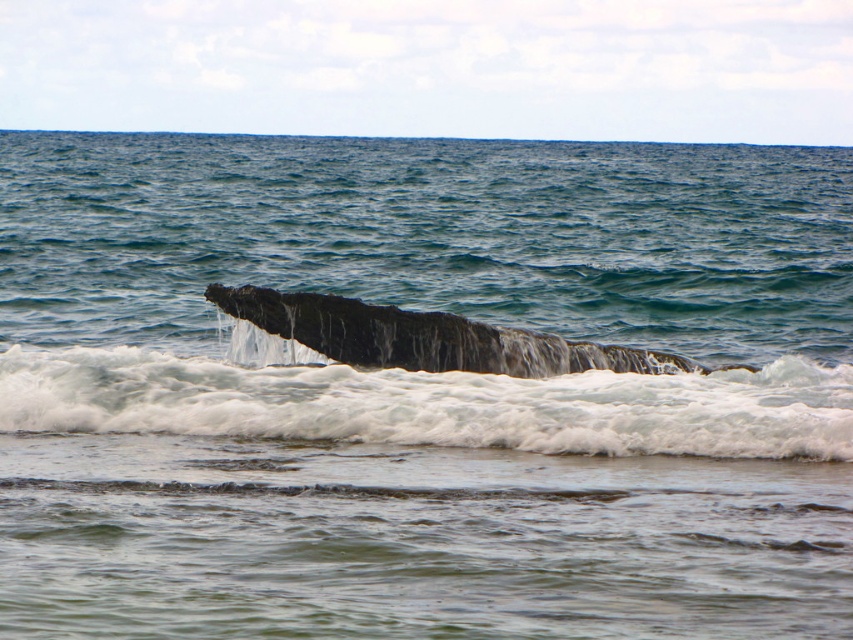
In the scene shown: Does dark gray textured rock at center come behind dark gray textured whale at center?

No, dark gray textured rock at center is closer to the viewer.

Who is more forward, (198, 422) or (701, 371)?

Positioned in front is point (198, 422).

In order to click on dark gray textured rock at center in this screenshot , I will do `click(432, 404)`.